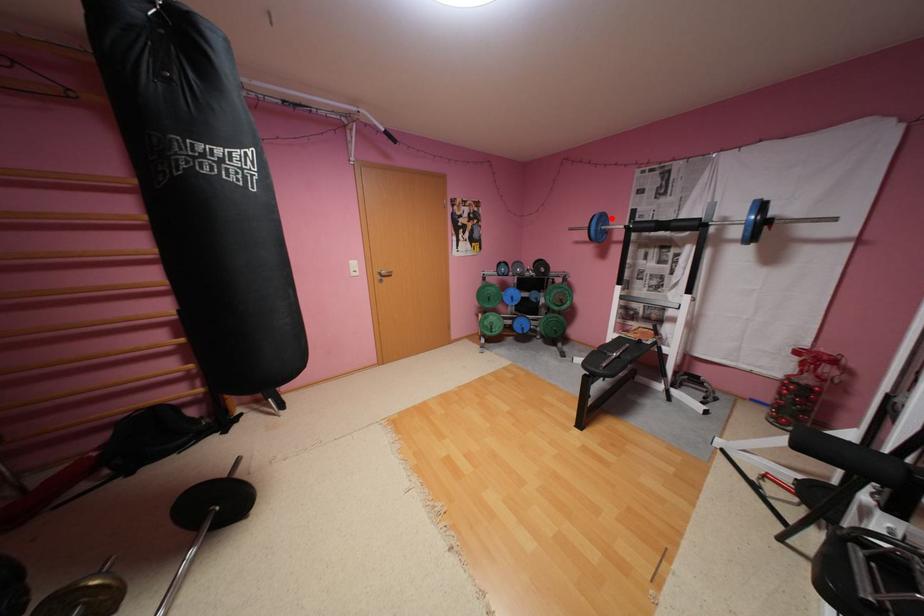
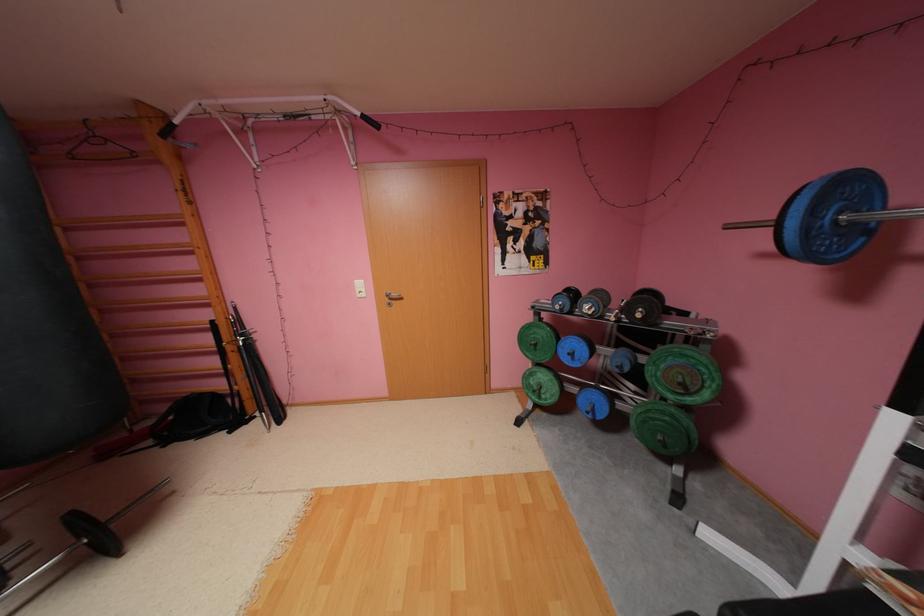
In the second image, find the point that corresponds to the highlighted location in the first image.

(855, 188)